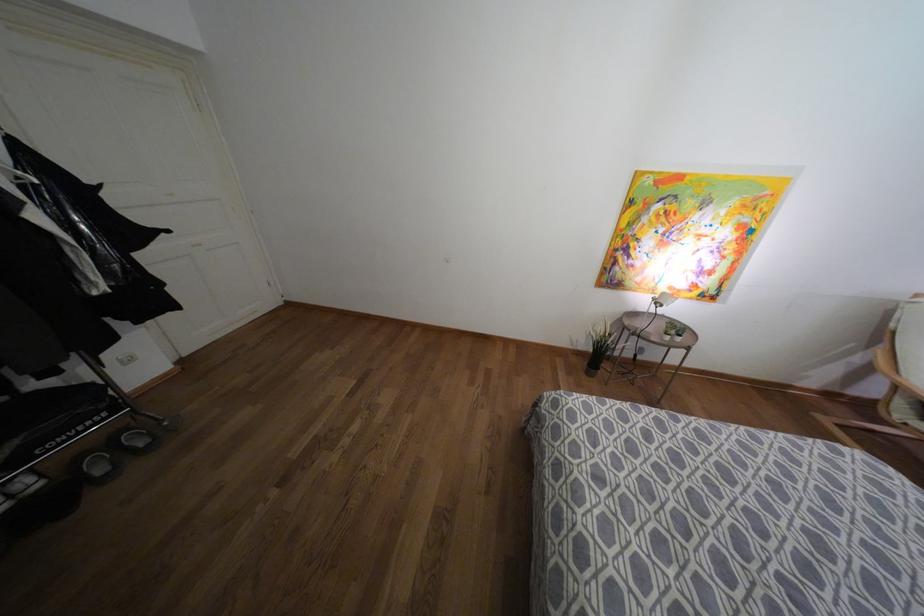
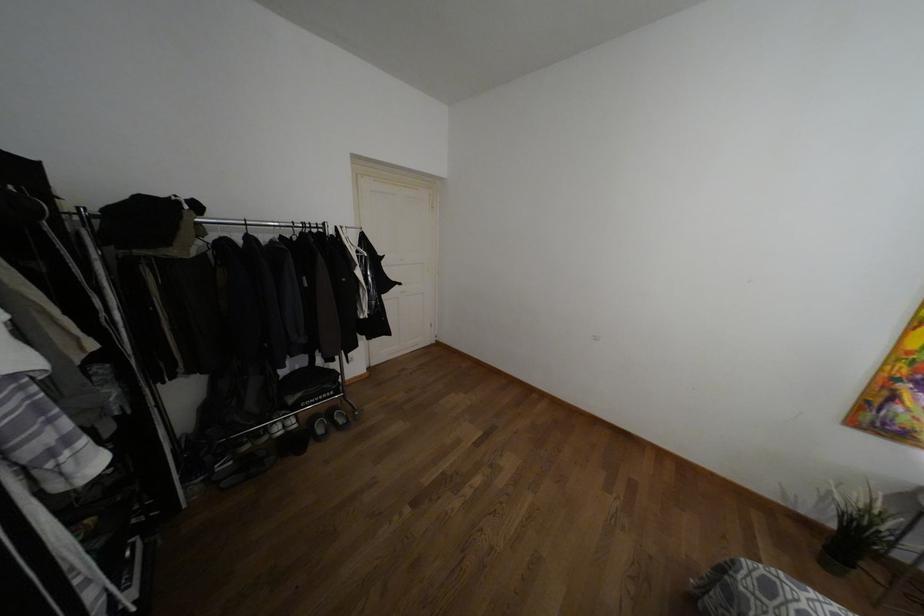
Question: The camera is either moving clockwise (left) or counter-clockwise (right) around the object. The first image is from the beginning of the video and the second image is from the end. Is the camera moving left or right when shooting the video?

Choices:
 (A) Left
 (B) Right

Answer: (B)